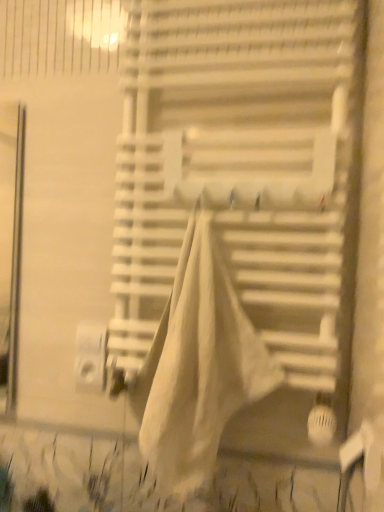
Question: Is white cotton blanket at center positioned far away from white plastic window blind at center?

Choices:
 (A) yes
 (B) no

Answer: (B)

Question: Is white cotton blanket at center shorter than white plastic window blind at center?

Choices:
 (A) no
 (B) yes

Answer: (B)

Question: From a real-world perspective, is white cotton blanket at center positioned under white plastic window blind at center based on gravity?

Choices:
 (A) yes
 (B) no

Answer: (A)

Question: Can you confirm if white cotton blanket at center is wider than white plastic window blind at center?

Choices:
 (A) yes
 (B) no

Answer: (A)

Question: Is white cotton blanket at center in front of white plastic window blind at center?

Choices:
 (A) no
 (B) yes

Answer: (B)

Question: Can we say white cotton blanket at center lies outside white plastic window blind at center?

Choices:
 (A) no
 (B) yes

Answer: (A)

Question: Is white plastic window blind at center taller than white cotton blanket at center?

Choices:
 (A) no
 (B) yes

Answer: (B)

Question: Are white plastic window blind at center and white cotton blanket at center beside each other?

Choices:
 (A) no
 (B) yes

Answer: (A)

Question: From a real-world perspective, is white plastic window blind at center on top of white cotton blanket at center?

Choices:
 (A) no
 (B) yes

Answer: (B)

Question: Does white plastic window blind at center have a lesser height compared to white cotton blanket at center?

Choices:
 (A) no
 (B) yes

Answer: (A)

Question: From the image's perspective, is white plastic window blind at center located beneath white cotton blanket at center?

Choices:
 (A) yes
 (B) no

Answer: (B)

Question: Is white cotton blanket at center inside white plastic window blind at center?

Choices:
 (A) yes
 (B) no

Answer: (A)

Question: From a real-world perspective, is white plastic window blind at center above or below white cotton blanket at center?

Choices:
 (A) above
 (B) below

Answer: (A)